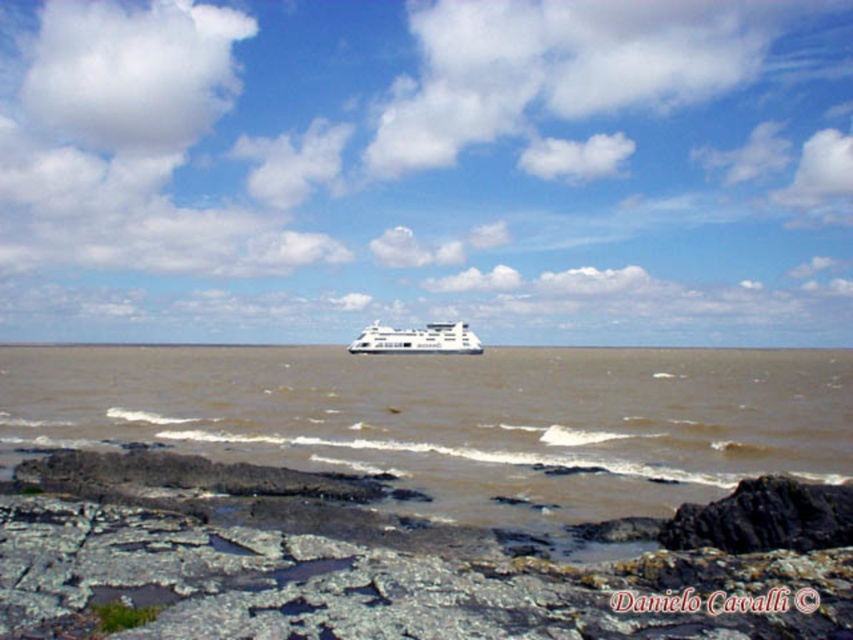
Is point (601, 504) positioned after point (428, 352)?

No.

Between point (741, 352) and point (361, 339), which one is positioned behind?

The point (741, 352) is behind.

Where is `brown matte water at center`? brown matte water at center is located at coordinates (459, 419).